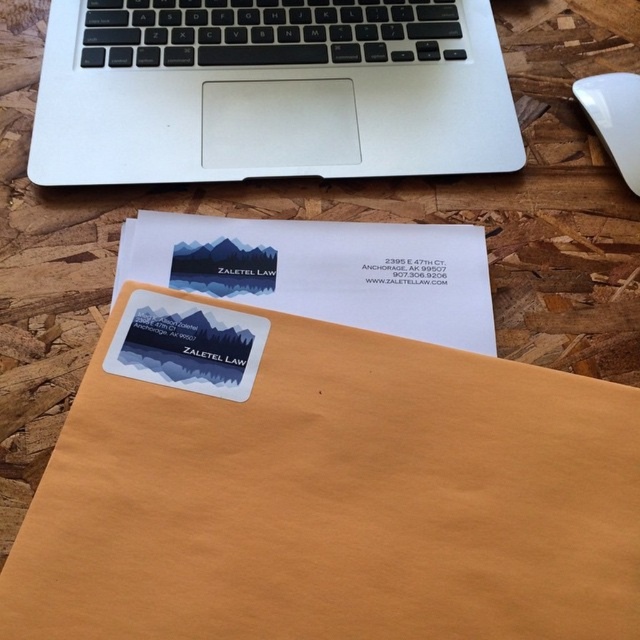
You are organizing your desk and want to place a 10 inch long ruler between the silver metallic laptop at upper center and the white plastic mouse at upper right. Will the ruler fit between them?

The distance between the silver metallic laptop at upper center and the white plastic mouse at upper right is 8.42 inches, so the 10 inch ruler will not fit between them as it is longer than the space available.

You are organizing your desk and want to place a new pen holder between the brown paper envelope at center and the white plastic mouse at upper right. Based on their current positions, which object should the pen holder be placed to the right of?

The pen holder should be placed to the right of the brown paper envelope at center because it is positioned to the left of the white plastic mouse at upper right.

You are organizing your desk and want to place a new item at point (269, 90). Is there already an object at that location?

Yes, the silver metallic laptop at upper center is located at point (269, 90).